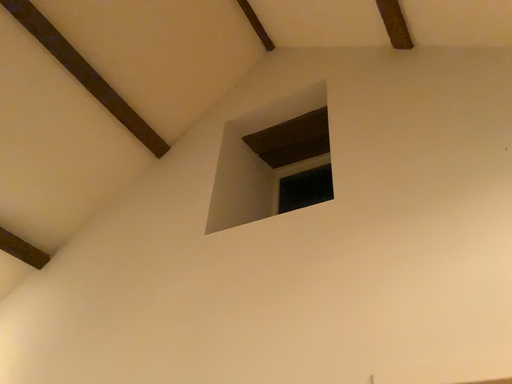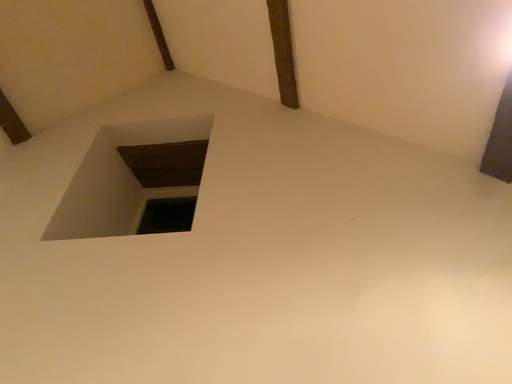
Question: How did the camera likely rotate when shooting the video?

Choices:
 (A) rotated left
 (B) rotated right

Answer: (B)